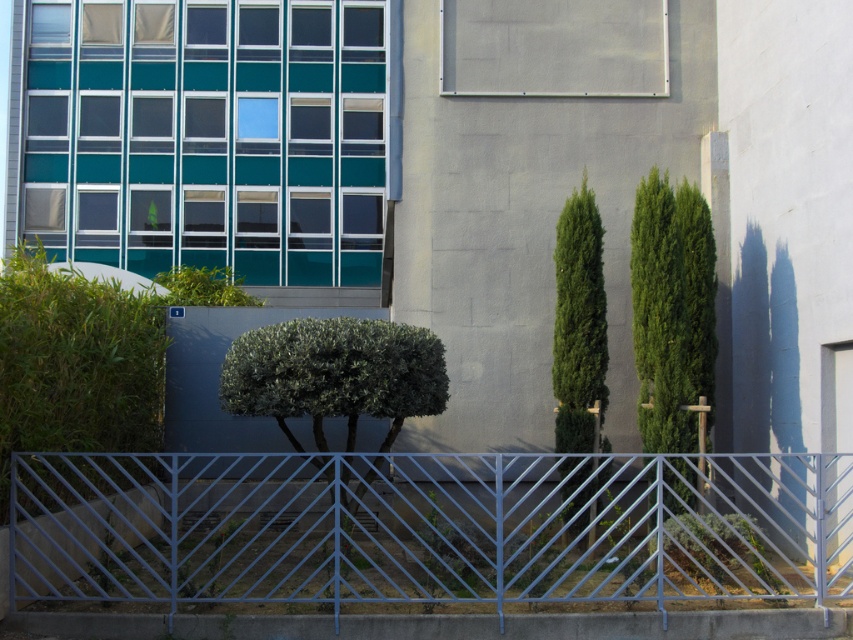
Question: Which of these objects is positioned closest to the green leafy tree at center right?

Choices:
 (A) green leafy hedge at left
 (B) green leafy bush at center
 (C) metallic blue fence at center
 (D) green leafy tree at right

Answer: (D)

Question: Can you confirm if green leafy bush at center is bigger than green leafy tree at right?

Choices:
 (A) no
 (B) yes

Answer: (B)

Question: Is green leafy hedge at left thinner than green leafy bush at center?

Choices:
 (A) no
 (B) yes

Answer: (B)

Question: Can you confirm if green leafy bush at center is positioned to the right of green leafy tree at center right?

Choices:
 (A) no
 (B) yes

Answer: (A)

Question: Which of the following is the closest to the observer?

Choices:
 (A) green leafy tree at right
 (B) metallic blue fence at center
 (C) green leafy tree at center right
 (D) green leafy hedge at left

Answer: (D)

Question: Estimate the real-world distances between objects in this image. Which object is farther from the green leafy hedge at left?

Choices:
 (A) metallic blue fence at center
 (B) green leafy bush at center
 (C) green leafy tree at right

Answer: (A)